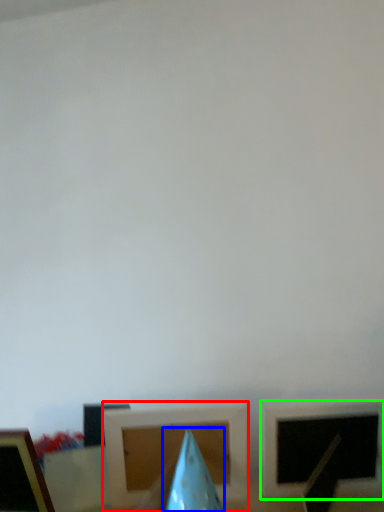
Question: Which object is the farthest from picture frame (highlighted by a red box)? Choose among these: exhaust hood (highlighted by a blue box) or picture frame (highlighted by a green box).

Choices:
 (A) exhaust hood
 (B) picture frame

Answer: (B)